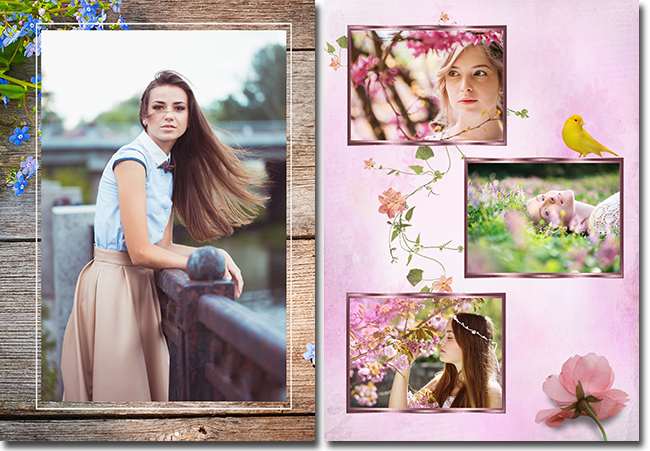
This screenshot has height=451, width=650. Identify the location of photos in collage. (234, 106), (382, 82), (526, 180), (430, 363).